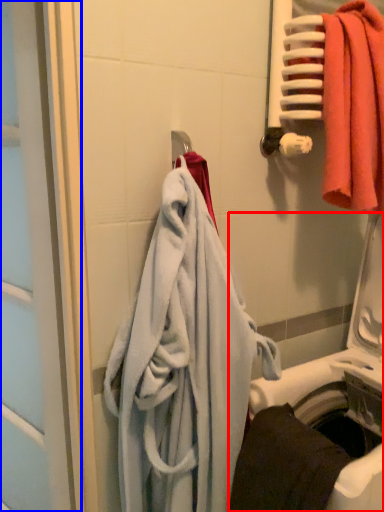
Question: Which object is closer to the camera taking this photo, washing machine (highlighted by a red box) or screen door (highlighted by a blue box)?

Choices:
 (A) washing machine
 (B) screen door

Answer: (A)